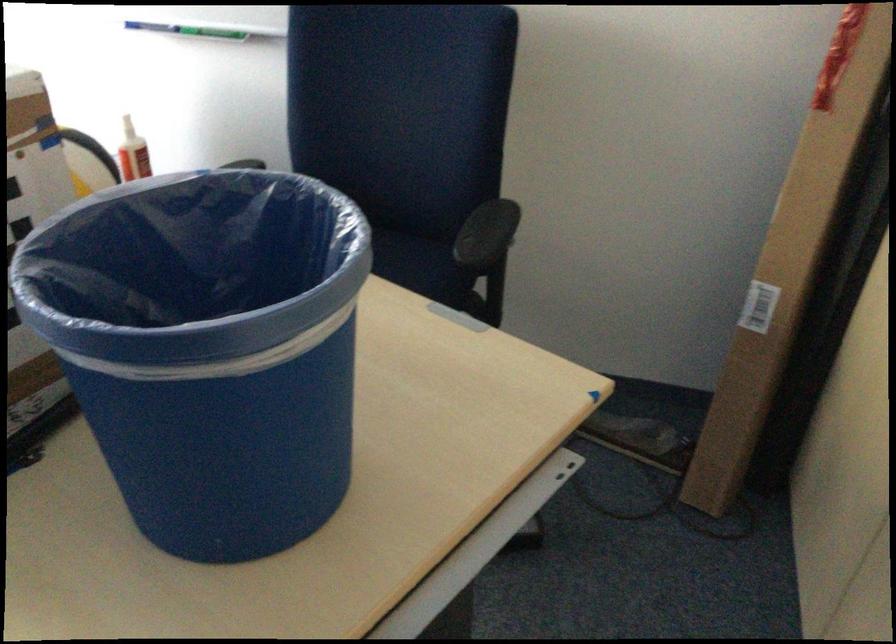
Describe the element at coordinates (486, 232) in the screenshot. I see `a black chair armrest` at that location.